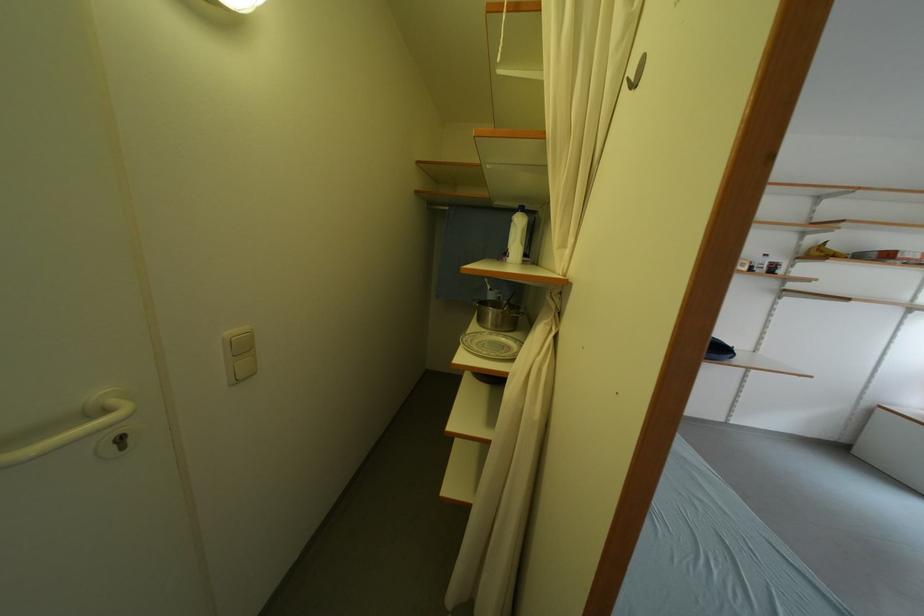
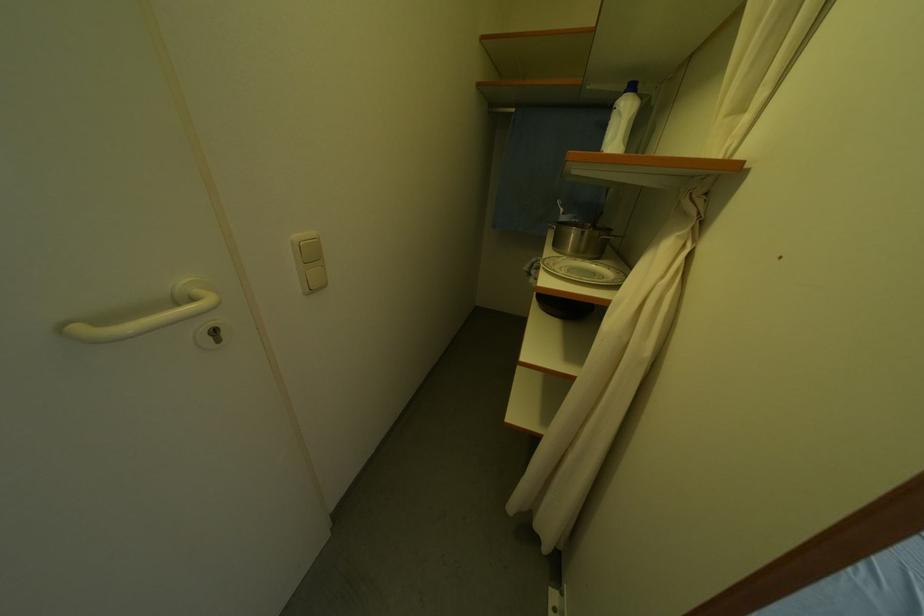
Find the pixel in the second image that matches point 517,306 in the first image.

(602, 228)